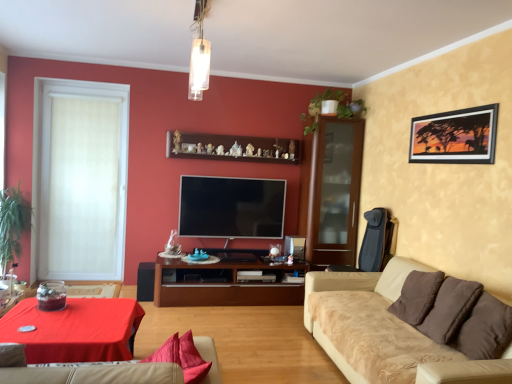
The height and width of the screenshot is (384, 512). I want to click on empty space that is ontop of flat screen tv at center (from a real-world perspective), so click(231, 175).